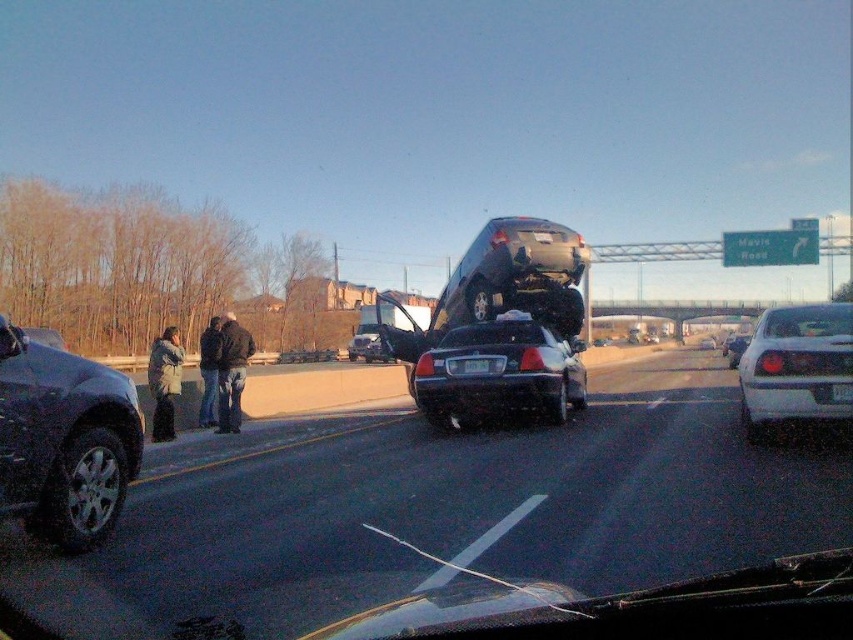
Between shiny black car at center and white plastic license plate at center, which one appears on the left side from the viewer's perspective?

Positioned to the left is shiny black car at center.

Can you confirm if shiny black car at center is smaller than white plastic license plate at center?

No.

The width and height of the screenshot is (853, 640). In order to click on shiny black car at center in this screenshot , I will do `click(444, 509)`.

Between white glossy sedan at right and black plastic license plate at center, which one is positioned higher?

Positioned higher is white glossy sedan at right.

Between white glossy sedan at right and black plastic license plate at center, which one has less height?

black plastic license plate at center is shorter.

At what (x,y) coordinates should I click in order to perform the action: click on white glossy sedan at right. Please return your answer as a coordinate pair (x, y). This screenshot has width=853, height=640. Looking at the image, I should click on [x=795, y=365].

You are a GUI agent. You are given a task and a screenshot of the screen. Output one action in this format:
    pyautogui.click(x=<x>, y=<y>)
    Task: Click on the white glossy sedan at right
    The height and width of the screenshot is (640, 853).
    Given the screenshot: What is the action you would take?
    pyautogui.click(x=795, y=365)

Between white glossy sedan at right and white plastic license plate at center, which one is positioned lower?

white plastic license plate at center is below.

Does point (758, 433) come behind point (851, 394)?

Yes, point (758, 433) is behind point (851, 394).

Locate an element on the screen. The image size is (853, 640). white glossy sedan at right is located at coordinates (795, 365).